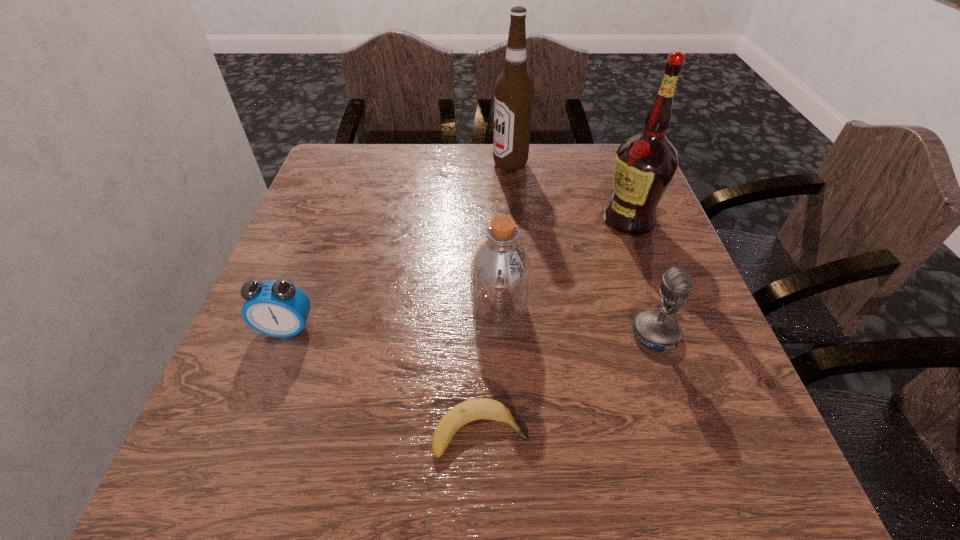
Find the location of a particular element. Image resolution: width=960 pixels, height=540 pixels. the farthest object is located at coordinates (513, 96).

Image resolution: width=960 pixels, height=540 pixels. What are the coordinates of `the farther alcohol` in the screenshot? It's located at click(x=513, y=96).

Identify the location of the right alcohol. pyautogui.click(x=644, y=165).

The image size is (960, 540). Identify the location of the second farthest object. (644, 165).

The height and width of the screenshot is (540, 960). I want to click on the third tallest object, so click(x=500, y=274).

In order to click on the fourth tallest object in this screenshot , I will do `click(656, 330)`.

Identify the location of the fifth tallest object. This screenshot has width=960, height=540. (278, 308).

Identify the location of alarm clock. (278, 308).

Where is `the shortest object`? This screenshot has height=540, width=960. the shortest object is located at coordinates (465, 412).

The image size is (960, 540). Identify the location of banana. (465, 412).